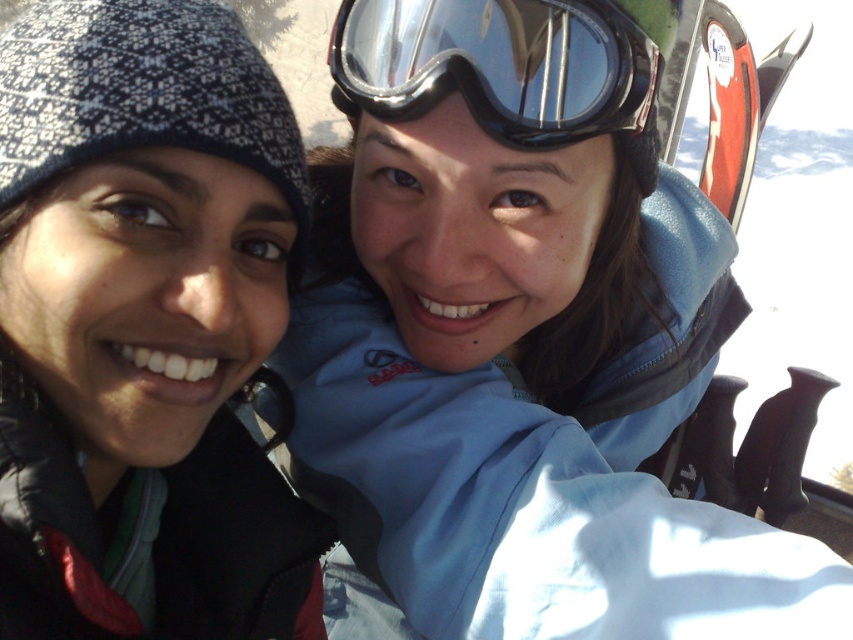
You are taking a photo of two people in winter gear. You want to focus on the person closer to the camera. Which coordinate point should you aim for, point (491, 99) or point (689, 13)?

You should aim for point (491, 99) because it is closer to the camera than point (689, 13).

You are planning to place a small gift box between the blue fabric jacket at center and the red plastic ski at upper right. The gift box requires at least 5 feet of space to fit. Based on the scene, will there be enough space?

The blue fabric jacket at center and red plastic ski at upper right are 5.25 feet apart from each other, which is more than the required 5 feet. Therefore, there is enough space to place the gift box between them.